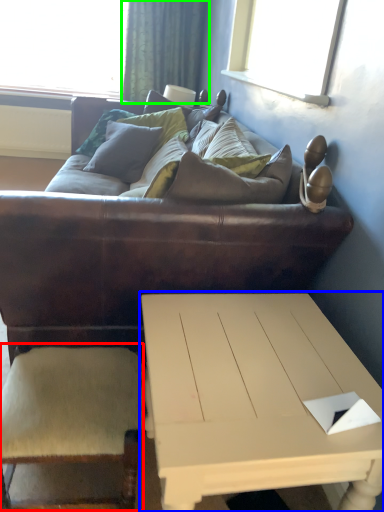
Question: Which object is the farthest from armchair (highlighted by a red box)? Choose among these: coffee table (highlighted by a blue box) or curtain (highlighted by a green box).

Choices:
 (A) coffee table
 (B) curtain

Answer: (B)